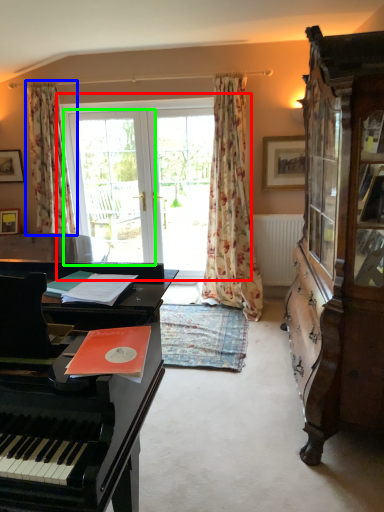
Question: Which object is positioned closest to bay window (highlighted by a red box)? Select from curtain (highlighted by a blue box) and screen door (highlighted by a green box).

Choices:
 (A) curtain
 (B) screen door

Answer: (B)